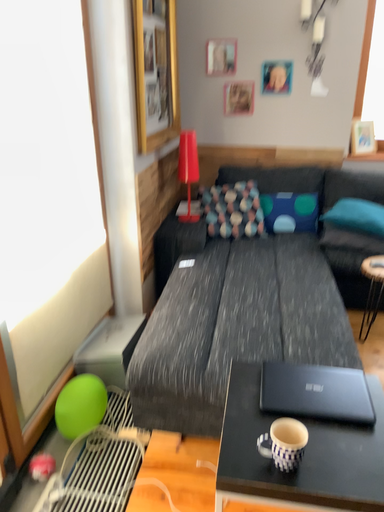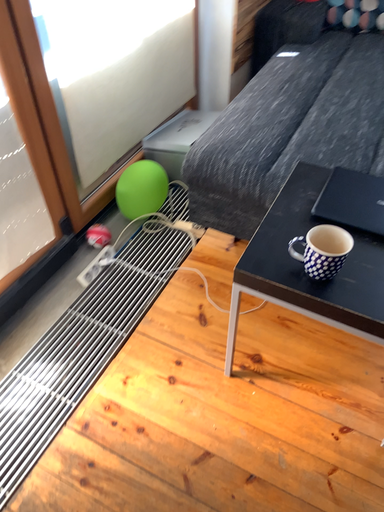
Question: How did the camera likely rotate when shooting the video?

Choices:
 (A) rotated left
 (B) rotated right

Answer: (A)